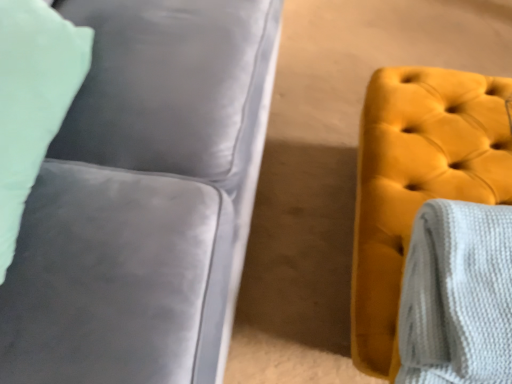
The image size is (512, 384). Find the location of `vacant space situated on the left part of velvet yellow ottoman at right`. vacant space situated on the left part of velvet yellow ottoman at right is located at coordinates (288, 245).